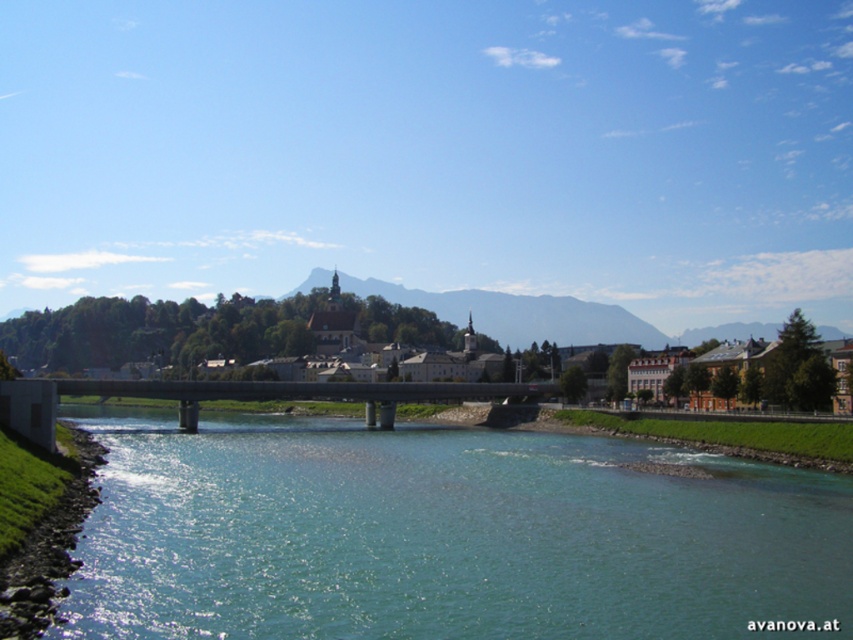
Question: Is clear water at center to the left of concrete bridge at center from the viewer's perspective?

Choices:
 (A) yes
 (B) no

Answer: (B)

Question: Observing the image, what is the correct spatial positioning of matte stone bridge at center in reference to concrete bridge at center?

Choices:
 (A) left
 (B) right

Answer: (B)

Question: Among these objects, which one is nearest to the camera?

Choices:
 (A) matte stone bridge at center
 (B) concrete bridge at center

Answer: (B)

Question: Which is farther from the clear water at center?

Choices:
 (A) concrete bridge at center
 (B) matte stone bridge at center

Answer: (B)

Question: Does clear water at center have a larger size compared to matte stone bridge at center?

Choices:
 (A) yes
 (B) no

Answer: (B)

Question: Estimate the real-world distances between objects in this image. Which object is closer to the concrete bridge at center?

Choices:
 (A) matte stone bridge at center
 (B) clear water at center

Answer: (B)